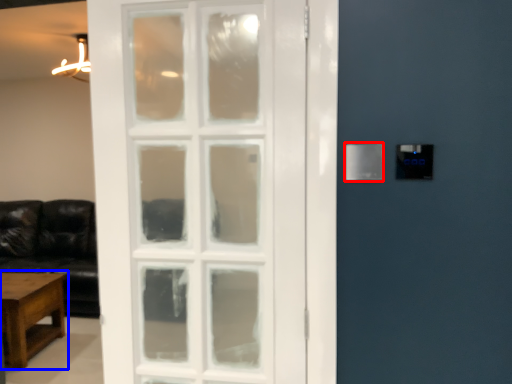
Question: Which of the following is the closest to the observer, light switch (highlighted by a red box) or table (highlighted by a blue box)?

Choices:
 (A) light switch
 (B) table

Answer: (A)